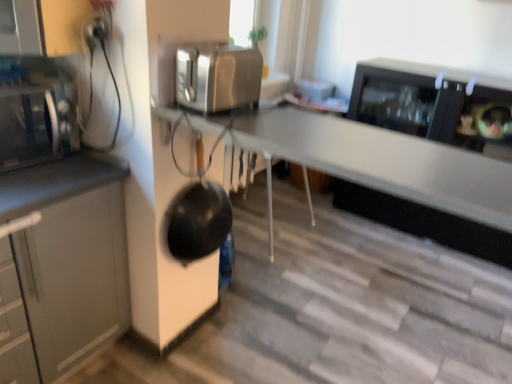
Question: Is black matte wok at center to the left of matte black microwave at left from the viewer's perspective?

Choices:
 (A) no
 (B) yes

Answer: (A)

Question: Is black matte wok at center placed right next to matte black microwave at left?

Choices:
 (A) no
 (B) yes

Answer: (A)

Question: Is black matte wok at center positioned with its back to matte black microwave at left?

Choices:
 (A) yes
 (B) no

Answer: (B)

Question: Is black matte wok at center smaller than matte black microwave at left?

Choices:
 (A) no
 (B) yes

Answer: (B)

Question: Considering the relative sizes of black matte wok at center and matte black microwave at left in the image provided, is black matte wok at center thinner than matte black microwave at left?

Choices:
 (A) yes
 (B) no

Answer: (A)

Question: Considering the relative positions of black matte wok at center and matte black microwave at left in the image provided, is black matte wok at center behind matte black microwave at left?

Choices:
 (A) no
 (B) yes

Answer: (B)

Question: Is satin silver toaster at upper center not near matte black microwave at left?

Choices:
 (A) no
 (B) yes

Answer: (A)

Question: Is satin silver toaster at upper center aimed at matte black microwave at left?

Choices:
 (A) no
 (B) yes

Answer: (A)

Question: From a real-world perspective, is satin silver toaster at upper center positioned over matte black microwave at left based on gravity?

Choices:
 (A) no
 (B) yes

Answer: (B)

Question: From the image's perspective, is satin silver toaster at upper center on top of matte black microwave at left?

Choices:
 (A) yes
 (B) no

Answer: (A)

Question: Considering the relative sizes of satin silver toaster at upper center and matte black microwave at left in the image provided, is satin silver toaster at upper center taller than matte black microwave at left?

Choices:
 (A) no
 (B) yes

Answer: (A)

Question: From a real-world perspective, is satin silver toaster at upper center located beneath matte black microwave at left?

Choices:
 (A) yes
 (B) no

Answer: (B)

Question: Considering the relative positions of matte black microwave at left and black matte wok at center in the image provided, is matte black microwave at left to the right of black matte wok at center from the viewer's perspective?

Choices:
 (A) no
 (B) yes

Answer: (A)